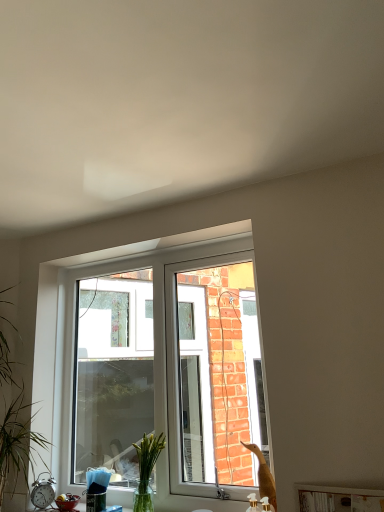
Question: Is silver metallic alarm clock at lower left positioned with its back to white plastic window at center?

Choices:
 (A) yes
 (B) no

Answer: (B)

Question: Considering the relative sizes of silver metallic alarm clock at lower left and white plastic window at center in the image provided, is silver metallic alarm clock at lower left taller than white plastic window at center?

Choices:
 (A) yes
 (B) no

Answer: (B)

Question: Can you confirm if silver metallic alarm clock at lower left is thinner than white plastic window at center?

Choices:
 (A) no
 (B) yes

Answer: (A)

Question: From a real-world perspective, is silver metallic alarm clock at lower left positioned under white plastic window at center based on gravity?

Choices:
 (A) yes
 (B) no

Answer: (A)

Question: Can you confirm if silver metallic alarm clock at lower left is wider than white plastic window at center?

Choices:
 (A) no
 (B) yes

Answer: (B)

Question: From the image's perspective, does silver metallic alarm clock at lower left appear higher than white plastic window at center?

Choices:
 (A) yes
 (B) no

Answer: (B)

Question: Is white glossy wood at lower center aimed at silver metallic alarm clock at lower left?

Choices:
 (A) no
 (B) yes

Answer: (A)

Question: Considering the relative positions of white glossy wood at lower center and silver metallic alarm clock at lower left in the image provided, is white glossy wood at lower center to the left of silver metallic alarm clock at lower left from the viewer's perspective?

Choices:
 (A) yes
 (B) no

Answer: (B)

Question: From a real-world perspective, does white glossy wood at lower center sit lower than silver metallic alarm clock at lower left?

Choices:
 (A) no
 (B) yes

Answer: (B)

Question: From the image's perspective, does white glossy wood at lower center appear higher than silver metallic alarm clock at lower left?

Choices:
 (A) no
 (B) yes

Answer: (B)

Question: Is silver metallic alarm clock at lower left a part of white glossy wood at lower center?

Choices:
 (A) yes
 (B) no

Answer: (B)

Question: Is white glossy wood at lower center positioned before silver metallic alarm clock at lower left?

Choices:
 (A) no
 (B) yes

Answer: (B)

Question: Is clear glass vase at center turned away from white plastic window at center?

Choices:
 (A) yes
 (B) no

Answer: (A)